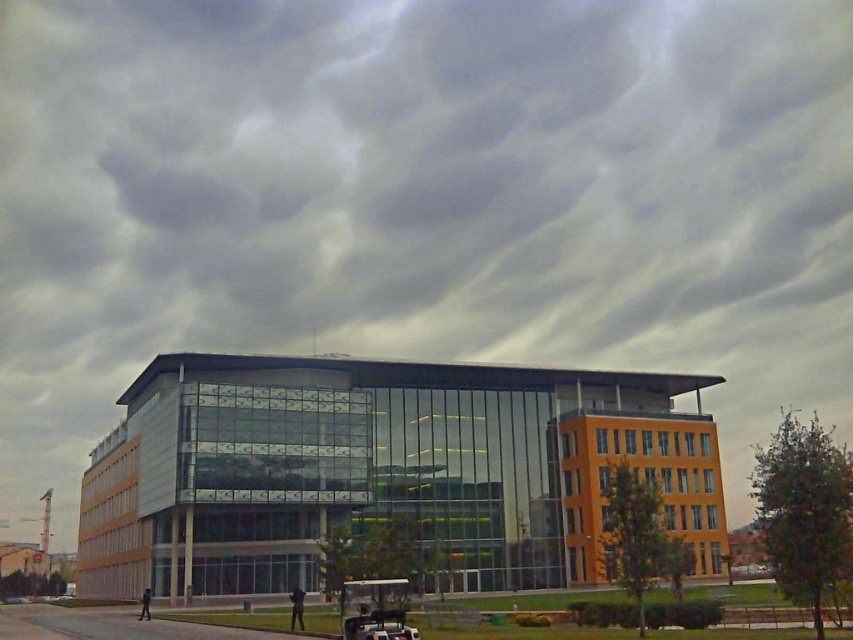
From the picture: You are a photographer trying to capture the glassy modern building at center and the white plastic golf cart at lower center in a single shot. Since the building is wider than the golf cart, which object should you frame first to ensure both are fully visible in your photo?

The glassy modern building at center is wider than the white plastic golf cart at lower center, so you should frame the glassy modern building at center first to accommodate its larger width, ensuring both objects fit within the shot.